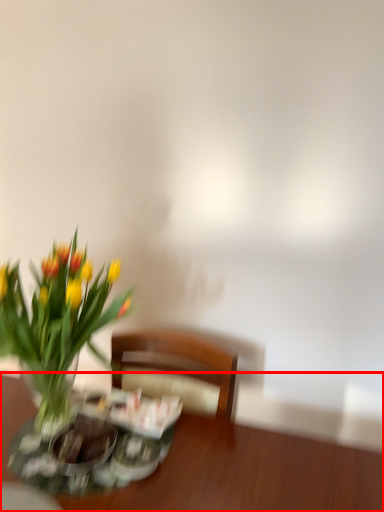
Question: Considering the relative positions of table (annotated by the red box) and flower in the image provided, where is table (annotated by the red box) located with respect to the staircase?

Choices:
 (A) right
 (B) left

Answer: (A)